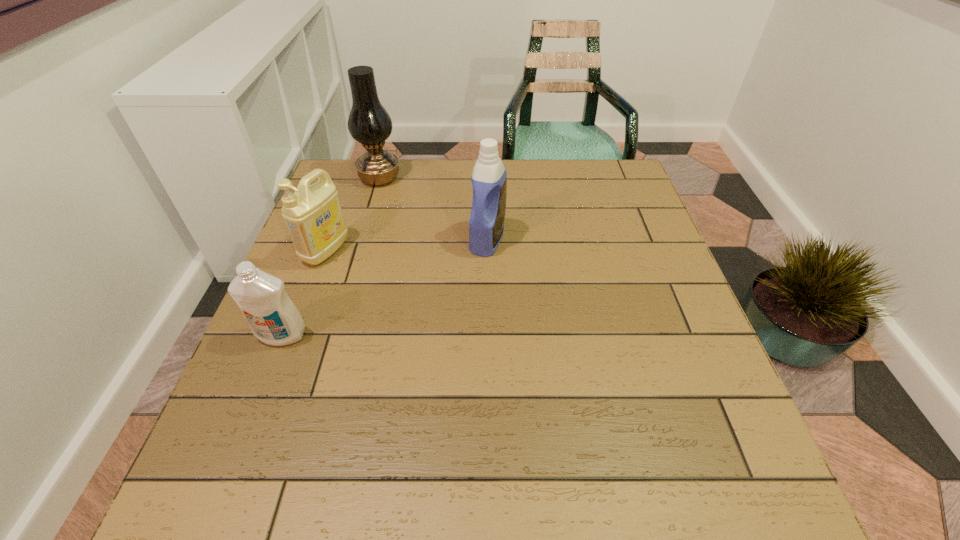
Where is `blank space at the far edge`? This screenshot has width=960, height=540. blank space at the far edge is located at coordinates (381, 195).

Where is `vacant space at the left edge`? The height and width of the screenshot is (540, 960). vacant space at the left edge is located at coordinates (261, 388).

Locate an element on the screen. The width and height of the screenshot is (960, 540). vacant space at the right edge of the desktop is located at coordinates (670, 361).

You are a GUI agent. You are given a task and a screenshot of the screen. Output one action in this format:
    pyautogui.click(x=<x>, y=<y>)
    Task: Click on the vacant space at the far right corner of the desktop
    
    Given the screenshot: What is the action you would take?
    pyautogui.click(x=617, y=167)

Identify the location of vacant region at the near right corner. (748, 508).

In order to click on free space between the rightmost detergent and the oil lamp in this screenshot , I will do `click(433, 209)`.

Identify the location of unoccupied position between the nearest object and the farthest object. This screenshot has width=960, height=540. (331, 256).

Where is `free spot between the oil lamp and the rightmost object`? Image resolution: width=960 pixels, height=540 pixels. free spot between the oil lamp and the rightmost object is located at coordinates (433, 209).

At what (x,y) coordinates should I click in order to perform the action: click on free spot between the oil lamp and the nearest detergent. Please return your answer as a coordinate pair (x, y). This screenshot has height=540, width=960. Looking at the image, I should click on (331, 256).

This screenshot has width=960, height=540. Identify the location of vacant space that's between the nearest object and the oil lamp. (331, 256).